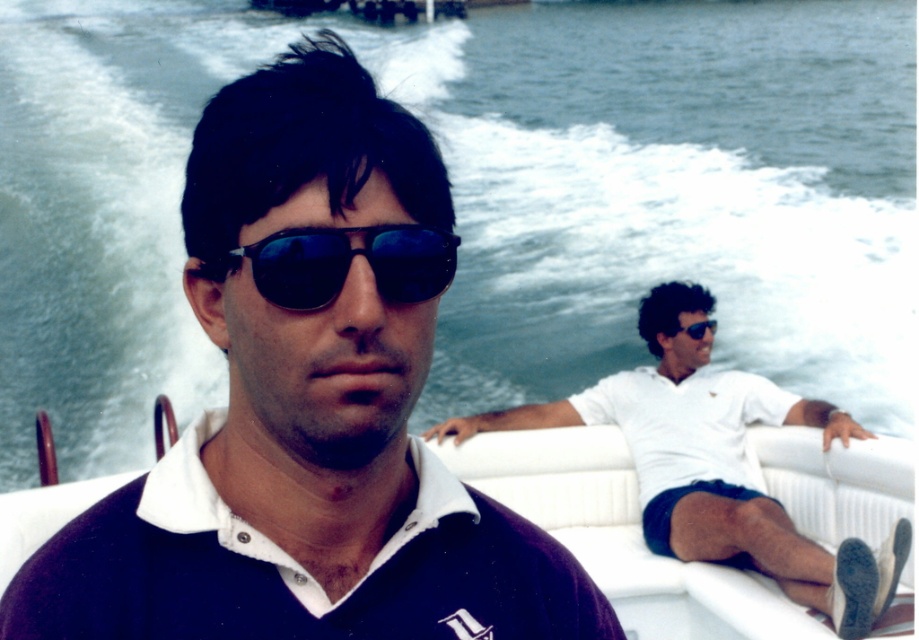
You are a photographer on the boat and want to take a picture of the matte black sunglasses at center and the navy blue cotton polo shirt at center. Which object should you focus on first if you want to capture both in one frame without moving the camera?

The navy blue cotton polo shirt at center should be focused on first because it is shorter than the matte black sunglasses at center, allowing the photographer to adjust the focus from the shorter to the taller object in one frame.

In the scene shown: You are navigating a drone to capture a closeup shot of the matte black sunglasses at center. The drone is currently at point 0.5, 0.5. Which direction should you move the drone to reach the sunglasses?

The matte black sunglasses at center are located at point (308, 406). Since the drone is at (459, 320), you need to move it northeast to reach the sunglasses.

You are a photographer trying to capture the matte black sunglasses at center and the white matte polo shirt at right in the same frame. Which object is closer to the camera based on their positions?

The matte black sunglasses at center is positioned over the white matte polo shirt at right, so it is closer to the camera.